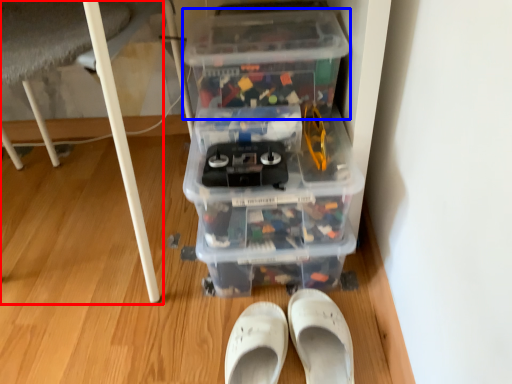
Question: Among these objects, which one is farthest to the camera, furniture (highlighted by a red box) or storage box (highlighted by a blue box)?

Choices:
 (A) furniture
 (B) storage box

Answer: (B)